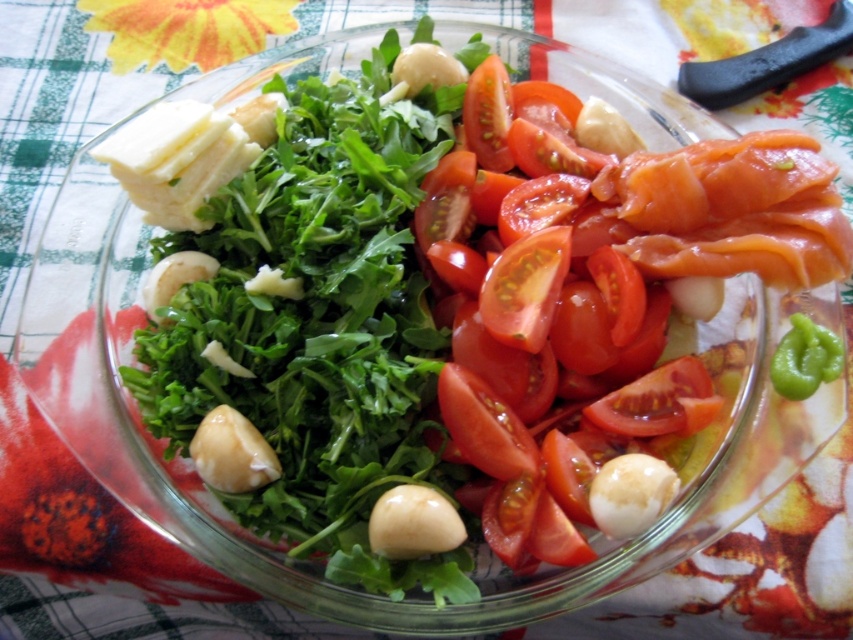
Does glossy red tomato at center have a smaller size compared to green matte pepper at lower right?

No.

Is glossy red tomato at center thinner than green matte pepper at lower right?

Incorrect, glossy red tomato at center's width is not less than green matte pepper at lower right's.

I want to click on glossy red tomato at center, so click(x=541, y=314).